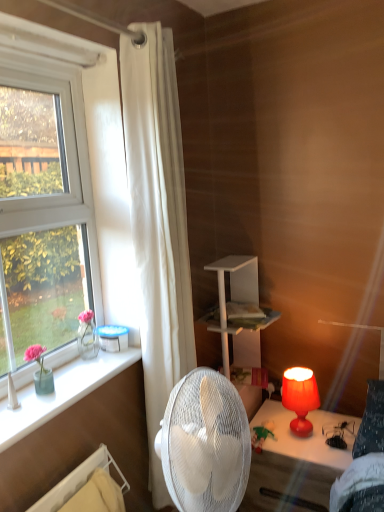
What are the coordinates of `free region under matte orange lampshade at lower right (from a real-world perspective)` in the screenshot? It's located at (304, 440).